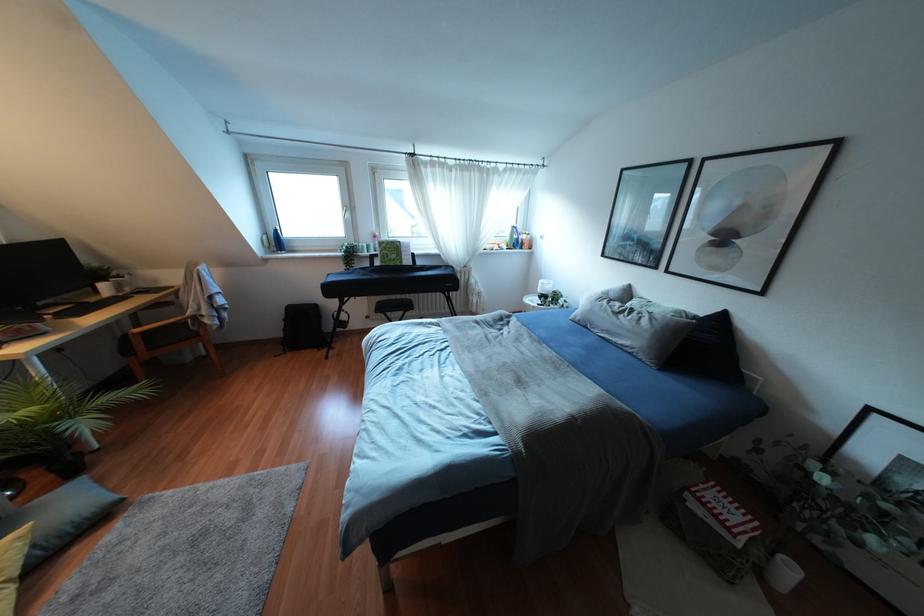
What do you see at coordinates (277, 240) in the screenshot?
I see `the blue water bottle` at bounding box center [277, 240].